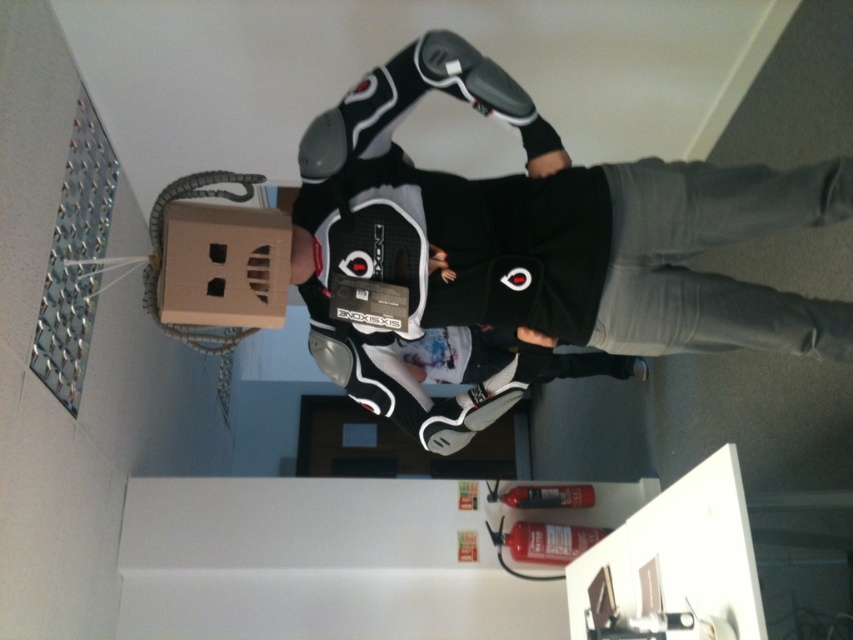
Who is lower down, black matte jacket at center or cardboard box at upper left?

cardboard box at upper left

Locate an element on the screen. black matte jacket at center is located at coordinates (550, 227).

Which is behind, point (769, 211) or point (250, 220)?

Point (250, 220)

Locate an element on the screen. black matte jacket at center is located at coordinates (550, 227).